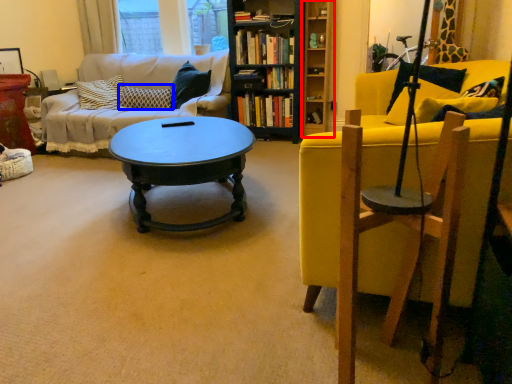
Question: Which point is further to the camera, shelf (highlighted by a red box) or pillow (highlighted by a blue box)?

Choices:
 (A) shelf
 (B) pillow

Answer: (B)